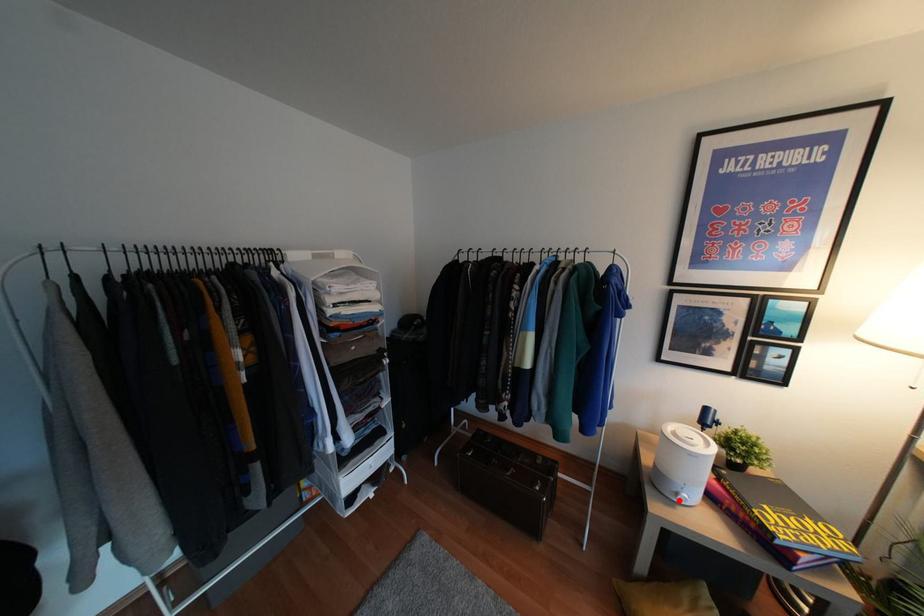
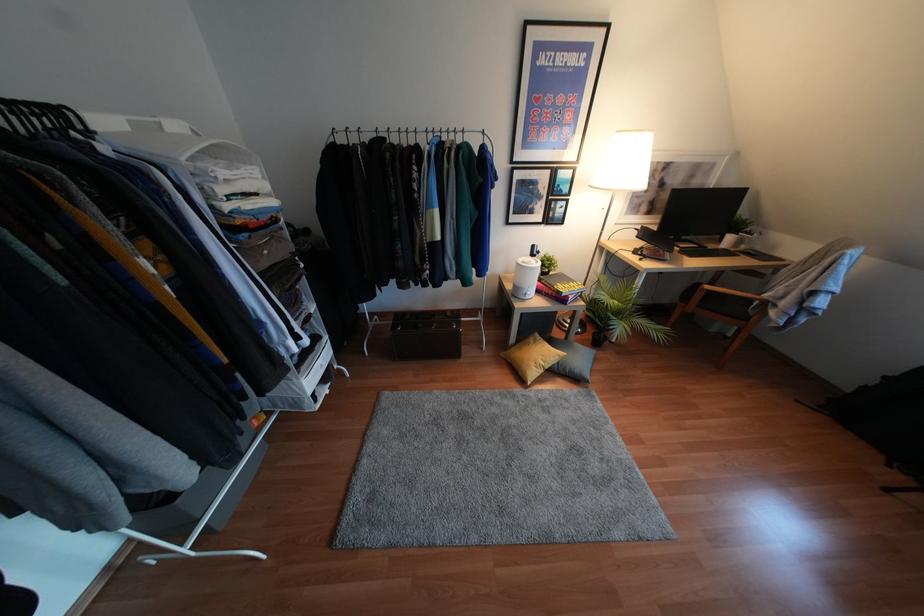
The point at the highlighted location is marked in the first image. Where is the corresponding point in the second image?

(526, 297)